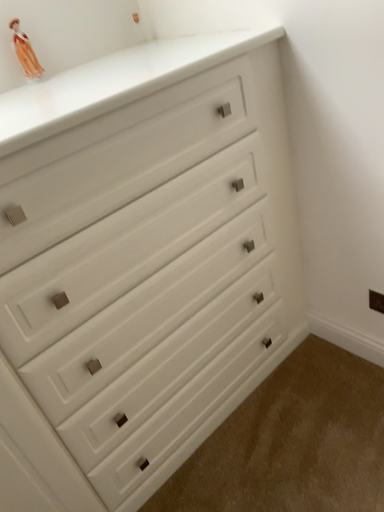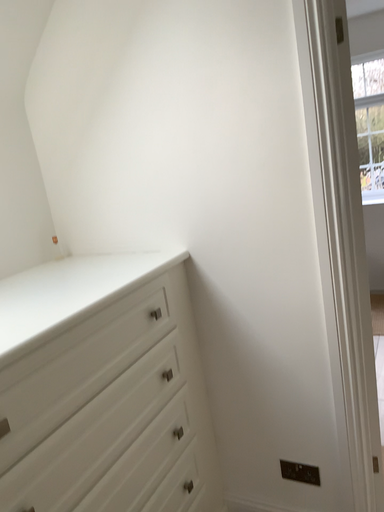
Question: How did the camera likely rotate when shooting the video?

Choices:
 (A) rotated downward
 (B) rotated upward

Answer: (B)